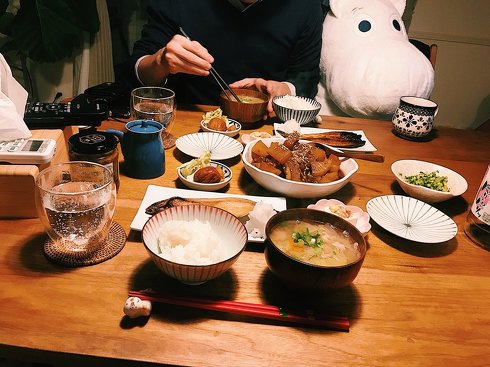
Locate an element on the screen. This screenshot has width=490, height=367. closest empty dish is located at coordinates (411, 223).